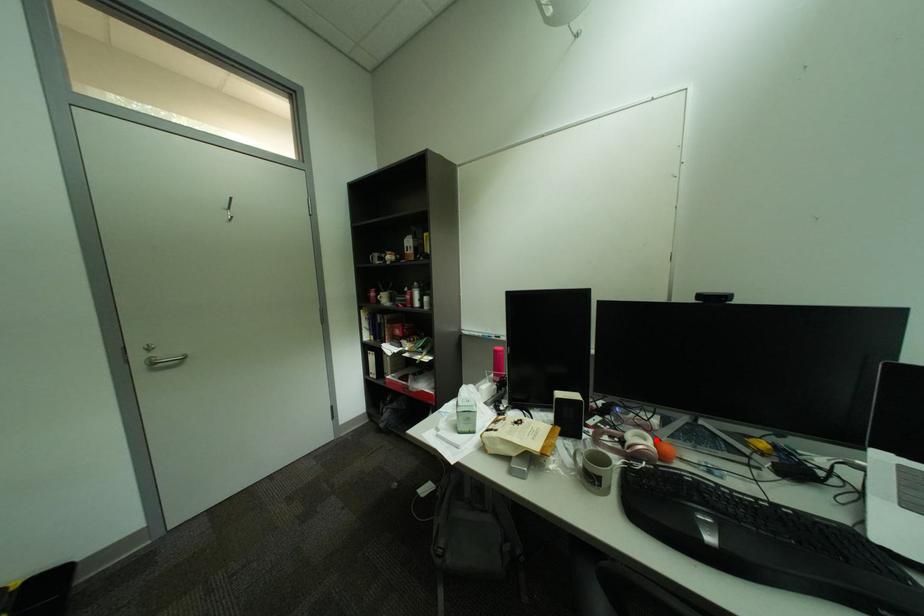
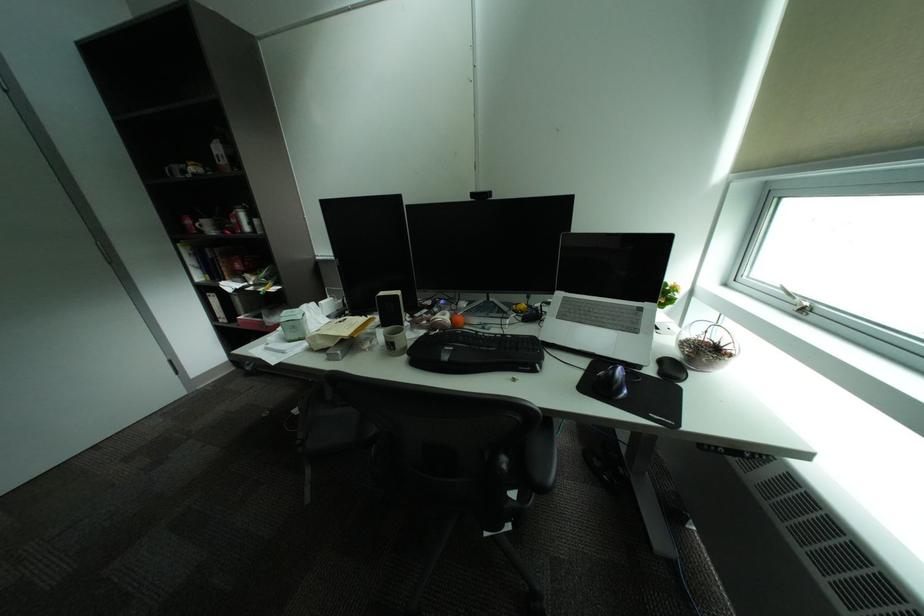
The point at the highlighted location is marked in the first image. Where is the corresponding point in the second image?

(456, 315)